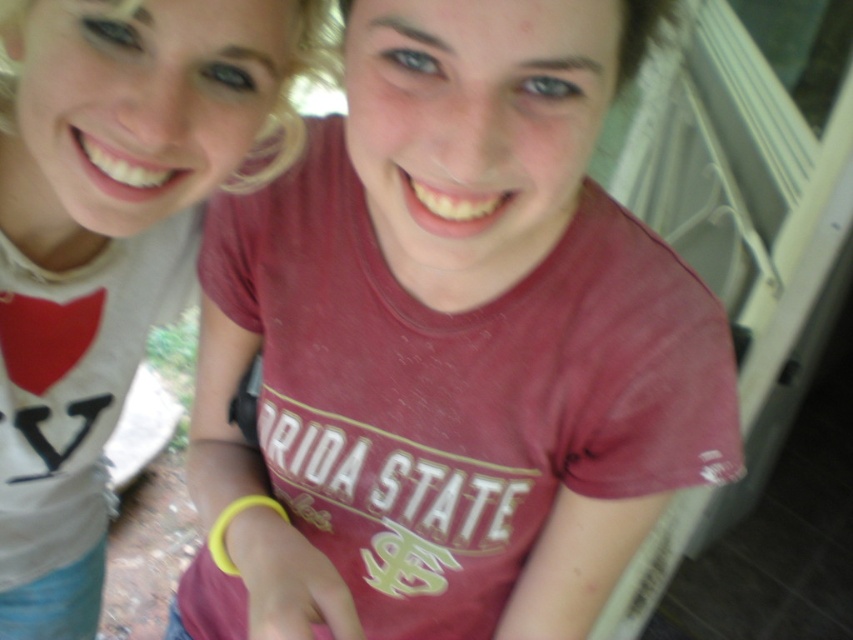
Question: Which object appears closest to the camera in this image?

Choices:
 (A) matte white t-shirt at upper left
 (B) maroon cotton t-shirt at center

Answer: (B)

Question: Which point is closer to the camera taking this photo?

Choices:
 (A) (207, 611)
 (B) (24, 65)

Answer: (B)

Question: In this image, where is maroon cotton t-shirt at center located relative to matte white t-shirt at upper left?

Choices:
 (A) above
 (B) below

Answer: (B)

Question: Among these objects, which one is nearest to the camera?

Choices:
 (A) maroon cotton t-shirt at center
 (B) matte white t-shirt at upper left

Answer: (A)

Question: Is maroon cotton t-shirt at center further to the viewer compared to matte white t-shirt at upper left?

Choices:
 (A) yes
 (B) no

Answer: (B)

Question: Can you confirm if maroon cotton t-shirt at center is positioned to the left of matte white t-shirt at upper left?

Choices:
 (A) yes
 (B) no

Answer: (B)